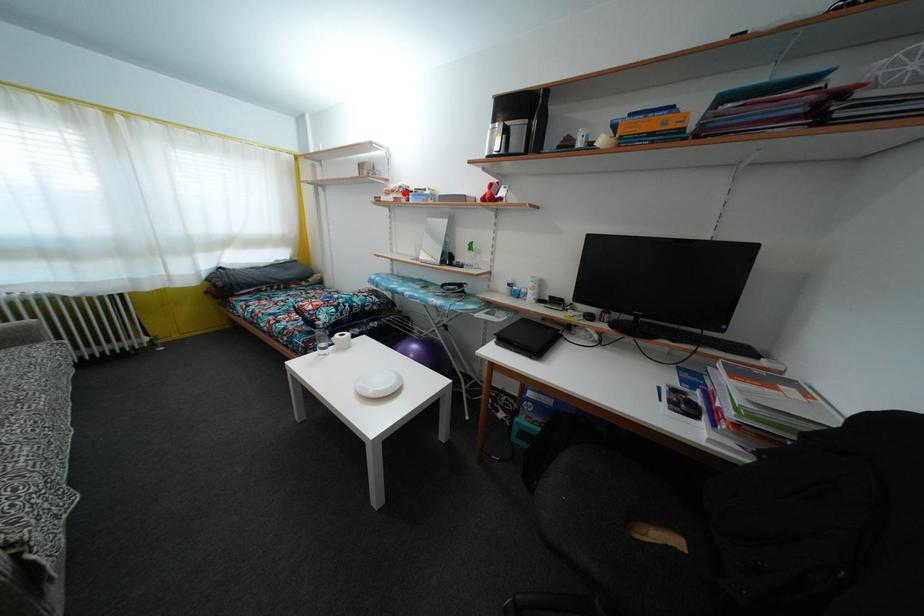
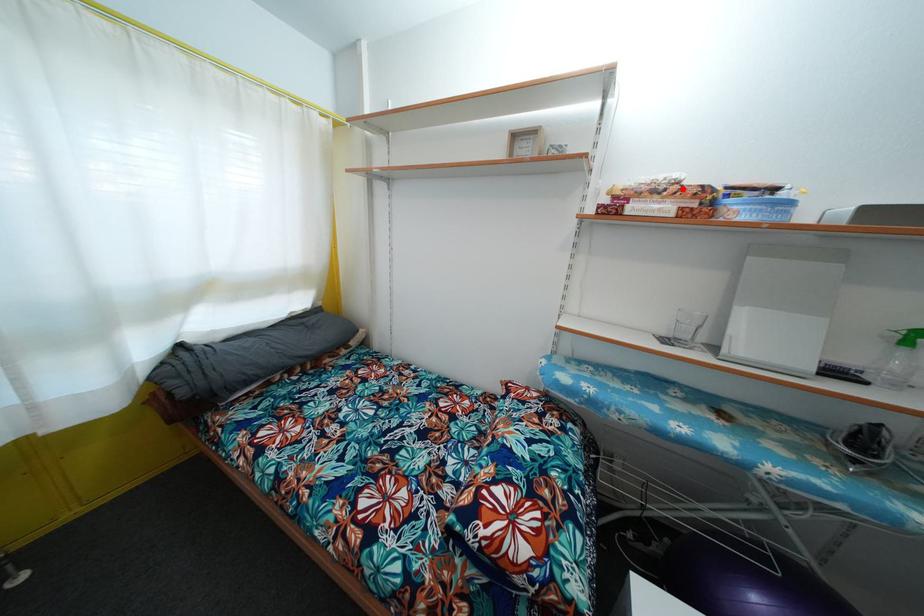
I am providing you with two images of the same scene from different viewpoints. A red point is marked on the first image and another point is marked on the second image. Is the marked point in image1 the same physical position as the marked point in image2?

Yes